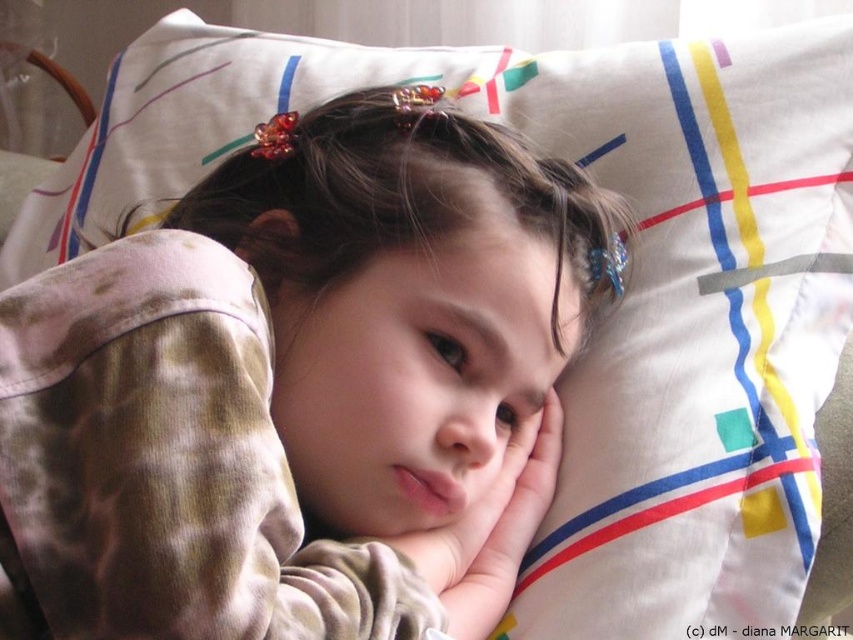
Question: Which object appears closest to the camera in this image?

Choices:
 (A) soft skin hand at center
 (B) camouflage pajamas at center

Answer: (B)

Question: Is camouflage pajamas at center to the left of soft skin hand at center from the viewer's perspective?

Choices:
 (A) no
 (B) yes

Answer: (B)

Question: Can you confirm if camouflage pajamas at center is wider than soft skin hand at center?

Choices:
 (A) no
 (B) yes

Answer: (B)

Question: Among these objects, which one is farthest from the camera?

Choices:
 (A) soft skin hand at center
 (B) camouflage pajamas at center

Answer: (A)

Question: Is camouflage pajamas at center closer to camera compared to soft skin hand at center?

Choices:
 (A) yes
 (B) no

Answer: (A)

Question: Which point is closer to the camera?

Choices:
 (A) (489, 620)
 (B) (76, 595)

Answer: (B)